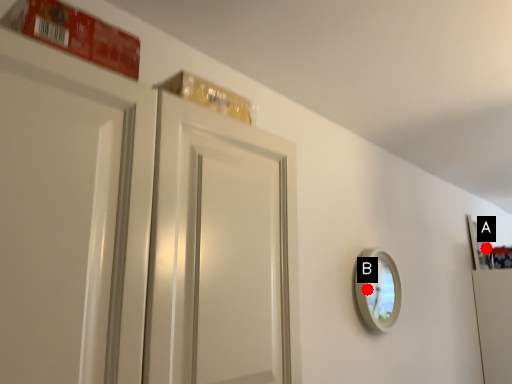
Question: Two points are circled on the image, labeled by A and B beside each circle. Which point is further to the camera?

Choices:
 (A) A is further
 (B) B is further

Answer: (A)